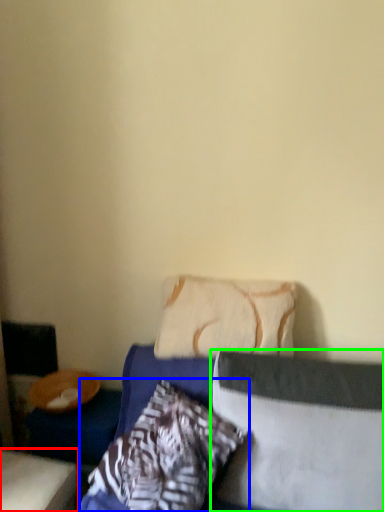
Question: Estimate the real-world distances between objects in this image. Which object is farther from furniture (highlighted by a red box), pillow (highlighted by a blue box) or pillow (highlighted by a green box)?

Choices:
 (A) pillow
 (B) pillow

Answer: (B)